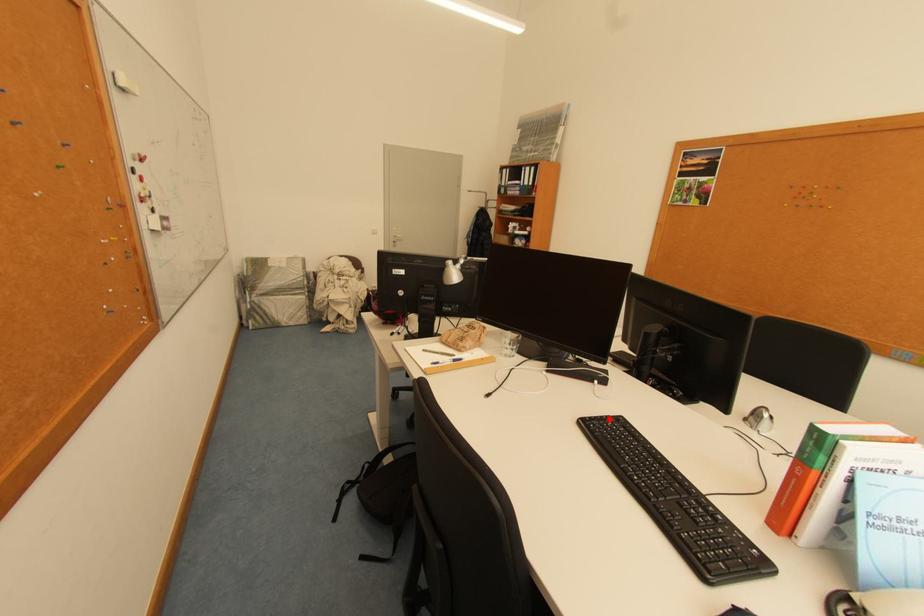
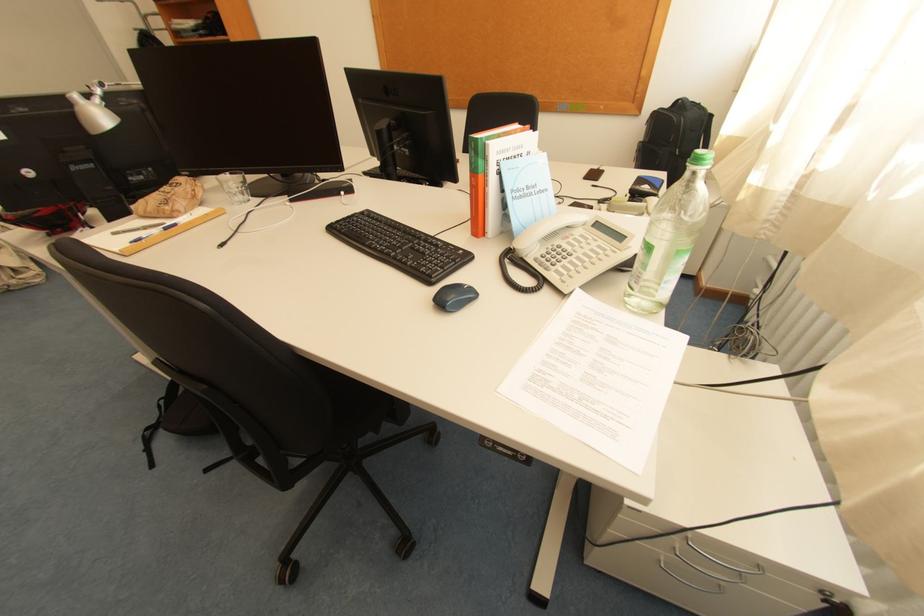
Find the pixel in the second image that matches the highlighted location in the first image.

(356, 219)